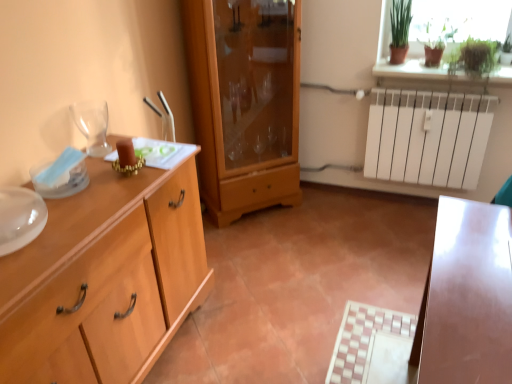
Question: Considering the positions of light wood chest of drawers at left and wooden cabinet at center in the image, is light wood chest of drawers at left bigger or smaller than wooden cabinet at center?

Choices:
 (A) small
 (B) big

Answer: (B)

Question: In terms of height, does light wood chest of drawers at left look taller or shorter compared to wooden cabinet at center?

Choices:
 (A) tall
 (B) short

Answer: (B)

Question: Which of these objects is positioned closest to the transparent glass wine glass at left?

Choices:
 (A) light wood chest of drawers at left
 (B) green matte plant at upper right
 (C) green glass vase at upper right
 (D) wooden cabinet at center

Answer: (A)

Question: Considering the real-world distances, which object is farthest from the green matte plant at upper right?

Choices:
 (A) transparent glass wine glass at left
 (B) wooden cabinet at center
 (C) light wood chest of drawers at left
 (D) green glass vase at upper right

Answer: (A)